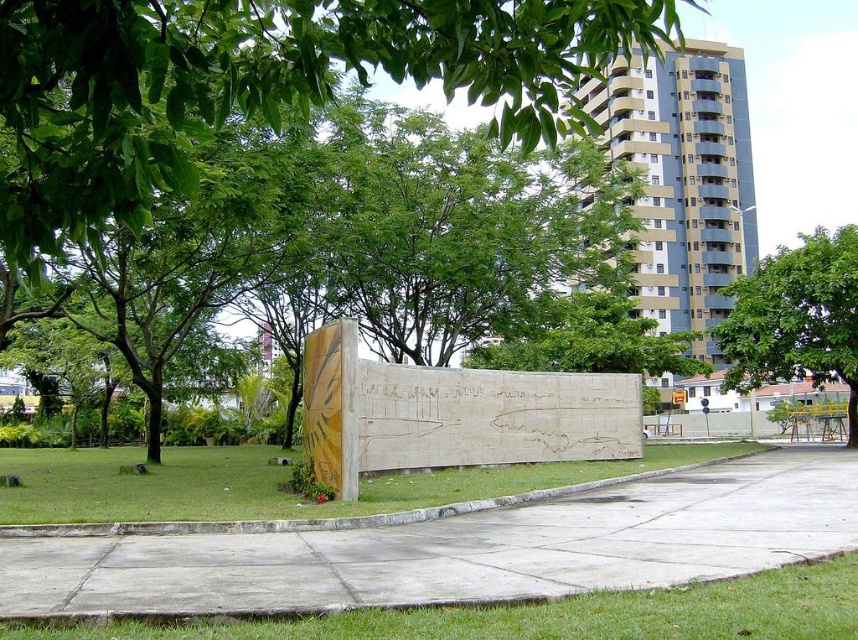
Does point (189, 176) come farther from viewer compared to point (352, 634)?

No, it is in front of (352, 634).

Between point (17, 134) and point (480, 621), which one is positioned behind?

The point (480, 621) is behind.

Does point (536, 16) come in front of point (421, 634)?

Yes, it is.

The height and width of the screenshot is (640, 858). Find the location of `green leafy tree at upper center`. green leafy tree at upper center is located at coordinates (263, 83).

Between point (397, 20) and point (741, 372), which one is positioned behind?

Positioned behind is point (741, 372).

Is green leafy tree at upper center below green leafy tree at right?

Incorrect, green leafy tree at upper center is not positioned below green leafy tree at right.

Is point (403, 1) closer to camera compared to point (783, 260)?

Yes, it is.

You are a GUI agent. You are given a task and a screenshot of the screen. Output one action in this format:
    pyautogui.click(x=<x>, y=<y>)
    Task: Click on the green leafy tree at upper center
    
    Given the screenshot: What is the action you would take?
    pyautogui.click(x=263, y=83)

Can you confirm if gray concrete pavement at center is positioned to the right of green leafy tree at right?

Incorrect, gray concrete pavement at center is not on the right side of green leafy tree at right.

Which is in front, point (594, 524) or point (771, 349)?

Point (594, 524)

Is point (438, 557) closer to viewer compared to point (849, 253)?

Yes.

The width and height of the screenshot is (858, 640). Identify the location of gray concrete pavement at center. (462, 548).